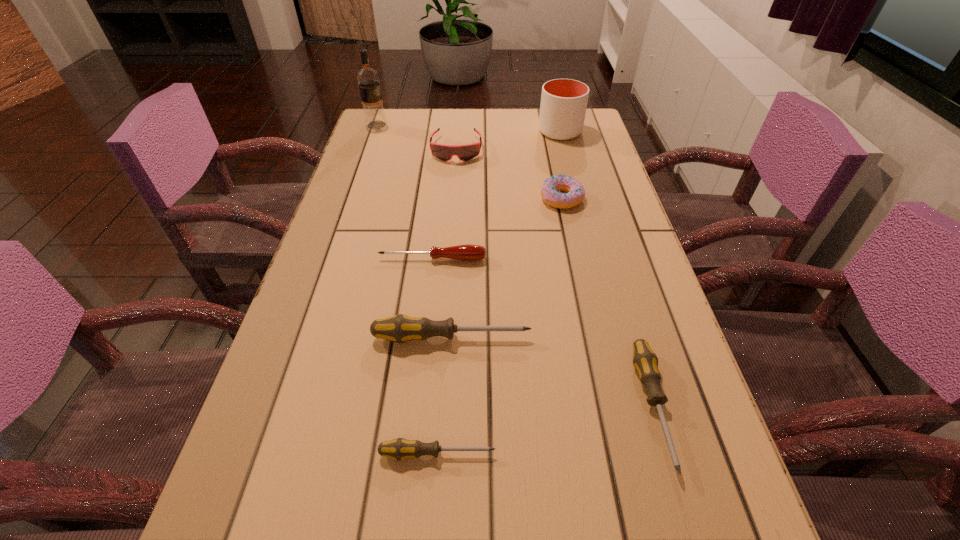
Where is `vodka`? Image resolution: width=960 pixels, height=540 pixels. vodka is located at coordinates (368, 79).

This screenshot has width=960, height=540. Find the location of `the leftmost object`. the leftmost object is located at coordinates (368, 79).

You are a GUI agent. You are given a task and a screenshot of the screen. Output one action in this format:
    pyautogui.click(x=<x>, y=<y>)
    Task: Click on the white cup
    
    Given the screenshot: What is the action you would take?
    pyautogui.click(x=563, y=106)

Find the location of `the second tallest object`. the second tallest object is located at coordinates (563, 106).

Where is `pink goggles`? pink goggles is located at coordinates (443, 152).

Locate an element on the screen. Image resolution: width=960 pixels, height=540 pixels. the tallest screwdriver is located at coordinates (400, 328).

At what (x,y) coordinates should I click in order to perform the action: click on doughnut. Please return your answer as a coordinate pair (x, y). The height and width of the screenshot is (540, 960). Looking at the image, I should click on (550, 191).

Identify the location of purple doughnut. (550, 191).

Locate an element on the screen. Image resolution: width=960 pixels, height=540 pixels. the rightmost screwdriver is located at coordinates (645, 361).

Locate an element on the screen. the rightmost gray screwdriver is located at coordinates (645, 361).